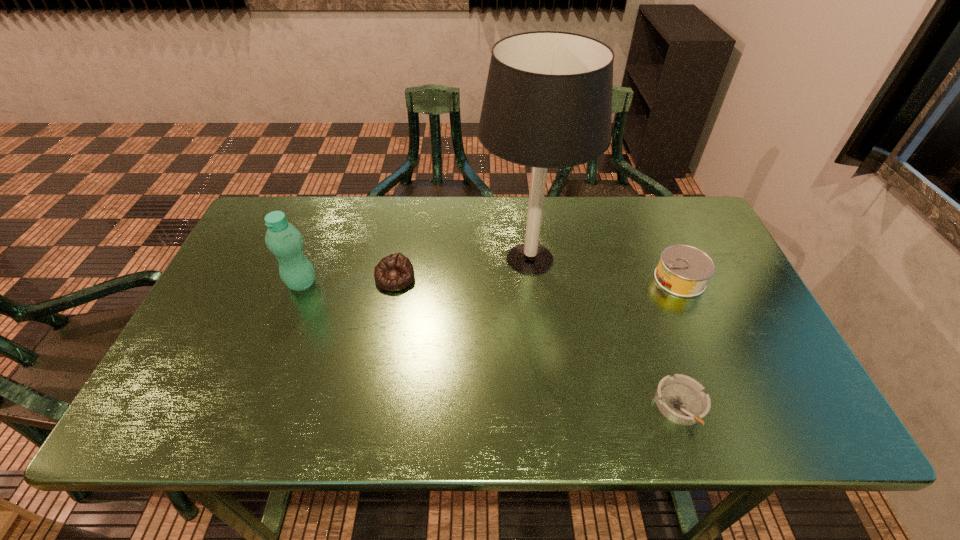
Image resolution: width=960 pixels, height=540 pixels. In the image, there is a desktop. Identify the location of blank space at the right edge. (739, 372).

In the image, there is a desktop. Where is `vacant space at the near right corner`? This screenshot has height=540, width=960. vacant space at the near right corner is located at coordinates click(x=751, y=403).

Image resolution: width=960 pixels, height=540 pixels. In order to click on vacant space in between the tallest object and the leftmost object in this screenshot , I will do `click(416, 271)`.

Where is `vacant area between the nearest object and the second object from left to right`? The image size is (960, 540). vacant area between the nearest object and the second object from left to right is located at coordinates (538, 342).

Image resolution: width=960 pixels, height=540 pixels. In order to click on free spot between the fourth tallest object and the can in this screenshot , I will do `click(538, 279)`.

Find the location of `blank region between the ashtray and the table lamp`. blank region between the ashtray and the table lamp is located at coordinates (605, 332).

The height and width of the screenshot is (540, 960). Find the location of `blank region between the table lamp and the can`. blank region between the table lamp and the can is located at coordinates (605, 269).

The height and width of the screenshot is (540, 960). Find the location of `blank region between the fourth object from right to left and the nearest object`. blank region between the fourth object from right to left and the nearest object is located at coordinates (538, 342).

Locate an element on the screen. Image resolution: width=960 pixels, height=540 pixels. empty space that is in between the second tallest object and the beanbag is located at coordinates pyautogui.click(x=348, y=280).

Where is `vacant area between the can and the tallest object`? The height and width of the screenshot is (540, 960). vacant area between the can and the tallest object is located at coordinates (605, 269).